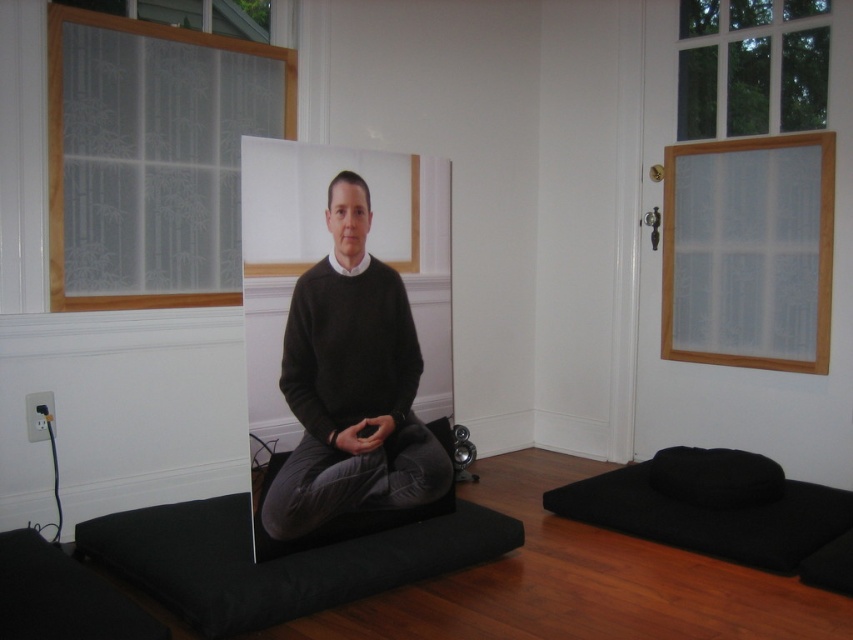
Question: Does black matte mat at lower right appear on the left side of black fabric pillow at lower right?

Choices:
 (A) yes
 (B) no

Answer: (A)

Question: Which of the following is the closest to the observer?

Choices:
 (A) (396, 292)
 (B) (674, 474)
 (C) (325, 298)

Answer: (C)

Question: Which of the following is the farthest from the observer?

Choices:
 (A) black fabric mat at center
 (B) matte black sweater at center
 (C) black fabric pillow at lower right

Answer: (C)

Question: Estimate the real-world distances between objects in this image. Which object is farther from the matte black sweater at center?

Choices:
 (A) black matte mat at lower right
 (B) black matte sweater at center
 (C) black fabric pillow at lower right
 (D) black fabric mat at center

Answer: (C)

Question: Does black matte sweater at center have a greater width compared to matte black sweater at center?

Choices:
 (A) no
 (B) yes

Answer: (B)

Question: Is matte black sweater at center below black matte mat at lower right?

Choices:
 (A) no
 (B) yes

Answer: (A)